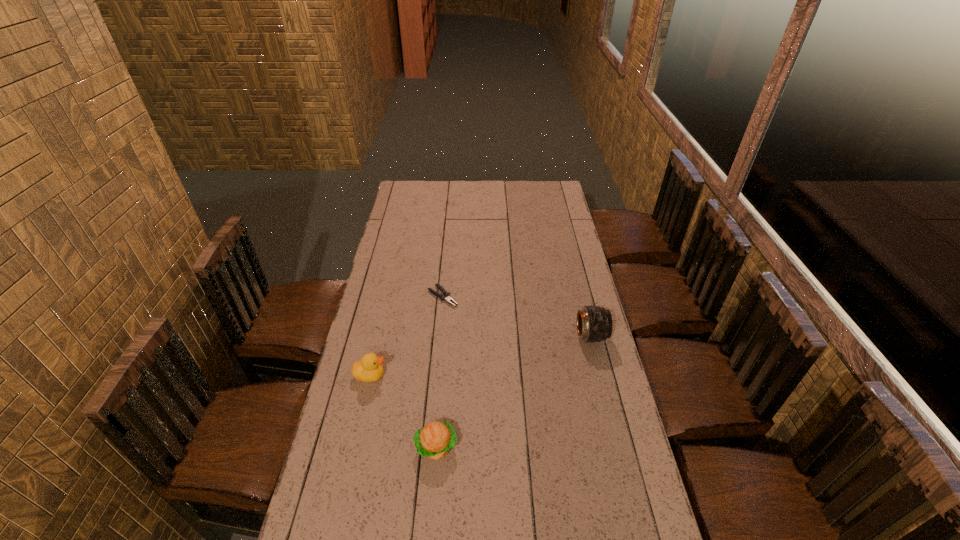
The height and width of the screenshot is (540, 960). What are the coordinates of `vacant spot on the desktop that is between the hamburger and the telephoto lens and is positioned at the gripping part of the shortest object` in the screenshot? It's located at pos(540,373).

The image size is (960, 540). Find the location of `free spot on the desktop that is between the nearest object and the tallest object and is positioned on the face of the duckling`. free spot on the desktop that is between the nearest object and the tallest object and is positioned on the face of the duckling is located at coordinates (518, 388).